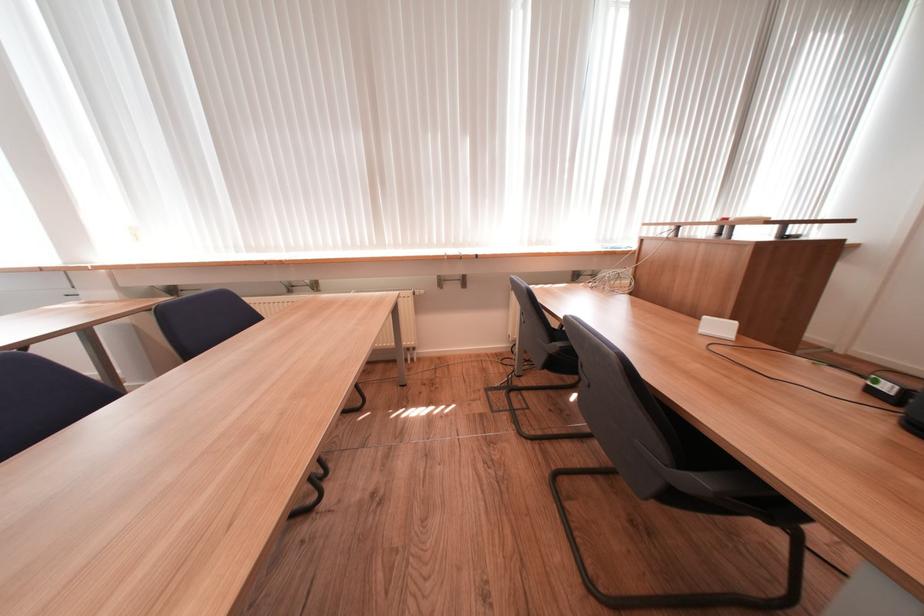
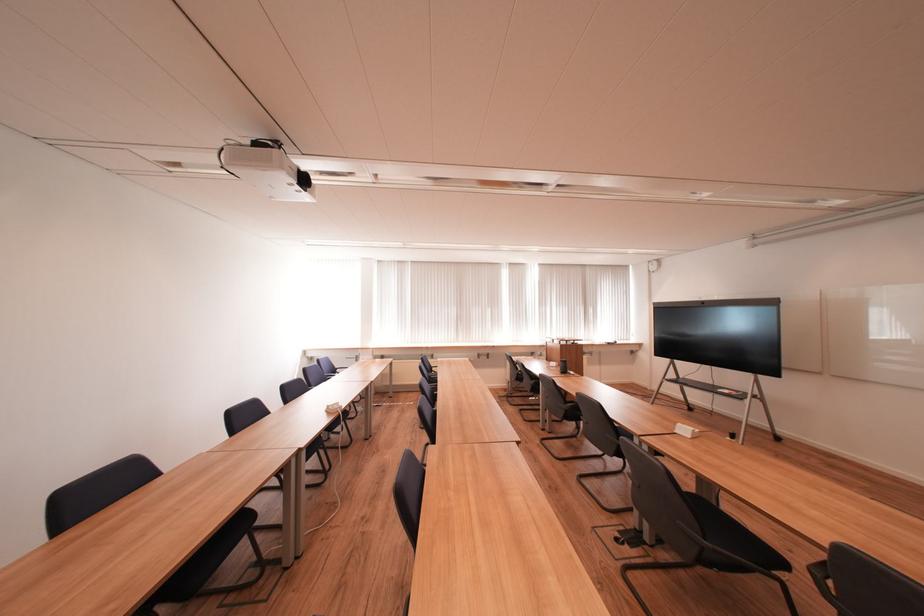
Question: What movement of the cameraman would produce the second image?

Choices:
 (A) Left
 (B) Right
 (C) Forward
 (D) Backward

Answer: (D)